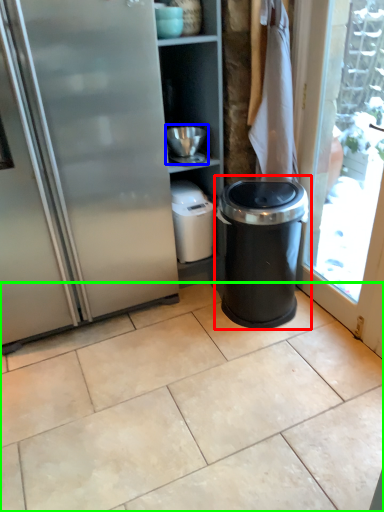
Question: Estimate the real-world distances between objects in this image. Which object is closer to waste container (highlighted by a red box), appliance (highlighted by a blue box) or ceramic tile (highlighted by a green box)?

Choices:
 (A) appliance
 (B) ceramic tile

Answer: (A)